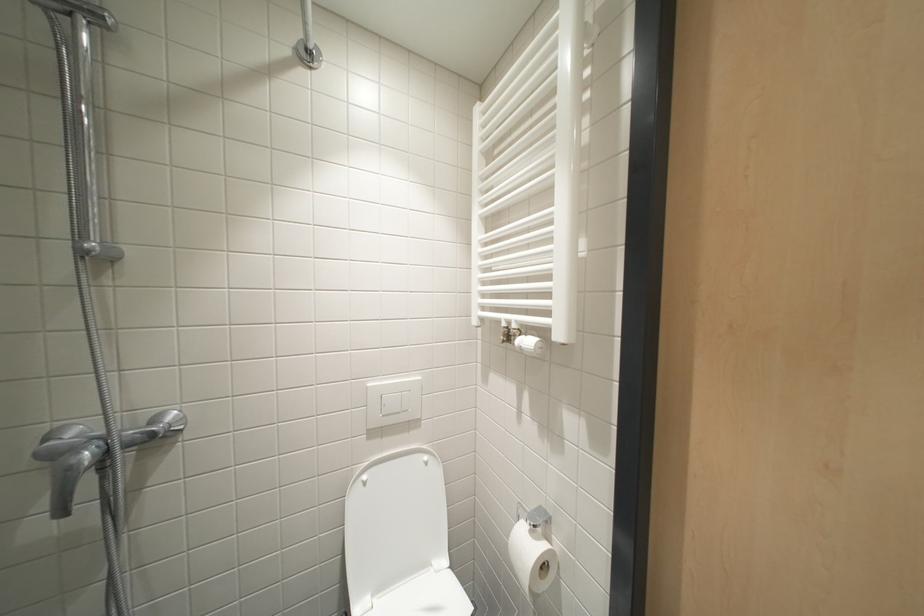
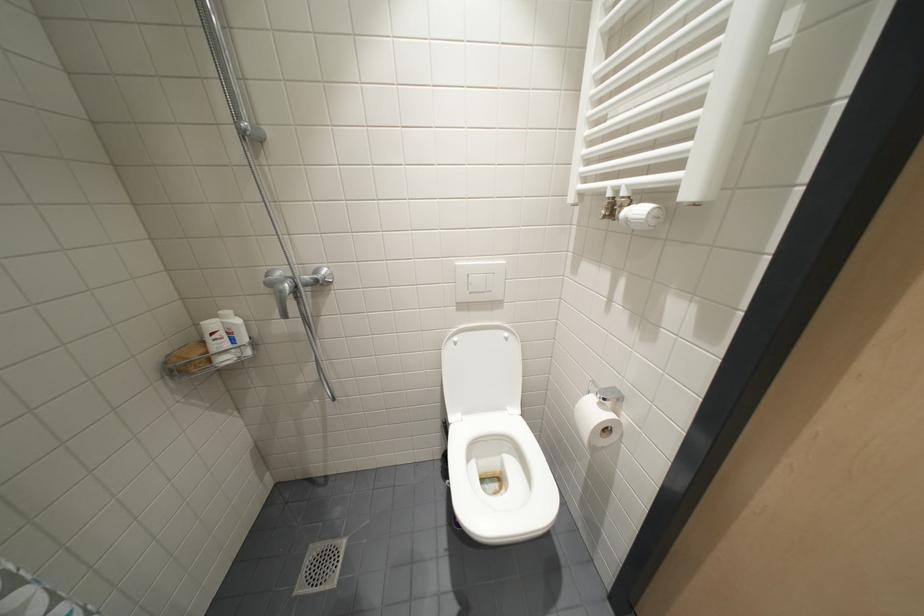
Question: Which direction would the cameraman need to move to produce the second image? Reply with the corresponding letter.

Choices:
 (A) Left
 (B) Right
 (C) Forward
 (D) Backward

Answer: (B)